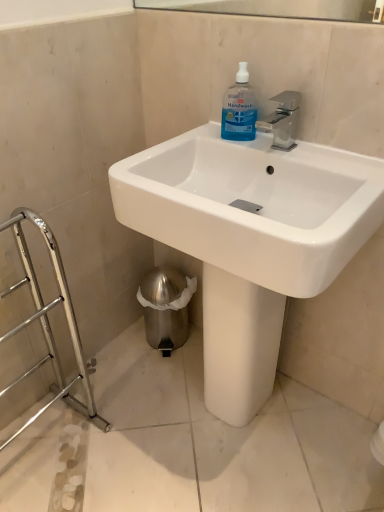
Describe the element at coordinates (239, 109) in the screenshot. I see `transparent plastic handwash at upper center` at that location.

What are the coordinates of `transparent plastic handwash at upper center` in the screenshot? It's located at (239, 109).

What is the approximate width of white glossy sink at center?

The width of white glossy sink at center is 17.06 inches.

What do you see at coordinates (250, 239) in the screenshot? This screenshot has width=384, height=512. I see `white glossy sink at center` at bounding box center [250, 239].

Image resolution: width=384 pixels, height=512 pixels. In order to click on white glossy sink at center in this screenshot , I will do (x=250, y=239).

What are the coordinates of `transparent plastic handwash at upper center` in the screenshot? It's located at [239, 109].

Visually, is white glossy sink at center positioned to the left or to the right of transparent plastic handwash at upper center?

white glossy sink at center is to the right of transparent plastic handwash at upper center.

Considering the relative positions of white glossy sink at center and transparent plastic handwash at upper center in the image provided, is white glossy sink at center behind transparent plastic handwash at upper center?

No, the depth of white glossy sink at center is less than that of transparent plastic handwash at upper center.

Which is less distant, (248, 180) or (224, 135)?

Point (248, 180) is positioned closer to the camera compared to point (224, 135).

From the image's perspective, between white glossy sink at center and transparent plastic handwash at upper center, which one is located above?

transparent plastic handwash at upper center.

From a real-world perspective, which is physically below, white glossy sink at center or transparent plastic handwash at upper center?

white glossy sink at center is physically lower.

Consider the image. Is white glossy sink at center thinner than transparent plastic handwash at upper center?

No.

Can you confirm if white glossy sink at center is shorter than transparent plastic handwash at upper center?

In fact, white glossy sink at center may be taller than transparent plastic handwash at upper center.

Does white glossy sink at center have a larger size compared to transparent plastic handwash at upper center?

Indeed, white glossy sink at center has a larger size compared to transparent plastic handwash at upper center.

Is white glossy sink at center surrounding transparent plastic handwash at upper center?

Yes, transparent plastic handwash at upper center is inside white glossy sink at center.

In the scene shown: Is white glossy sink at center far away from transparent plastic handwash at upper center?

Actually, white glossy sink at center and transparent plastic handwash at upper center are a little close together.

Is white glossy sink at center oriented away from transparent plastic handwash at upper center?

Yes, white glossy sink at center's orientation is away from transparent plastic handwash at upper center.

Measure the distance from white glossy sink at center to transparent plastic handwash at upper center.

13.64 inches.

Where is `sink located on the right of transparent plastic handwash at upper center`? This screenshot has width=384, height=512. sink located on the right of transparent plastic handwash at upper center is located at coordinates (250, 239).

In the scene shown: Between transparent plastic handwash at upper center and white glossy sink at center, which one appears on the right side from the viewer's perspective?

Positioned to the right is white glossy sink at center.

Does transparent plastic handwash at upper center come behind white glossy sink at center?

Yes, transparent plastic handwash at upper center is further from the viewer.

Is point (245, 116) closer or farther from the camera than point (332, 232)?

Point (245, 116) is farther from the camera than point (332, 232).

From the image's perspective, is transparent plastic handwash at upper center located above or below white glossy sink at center?

From the image's perspective, transparent plastic handwash at upper center appears above white glossy sink at center.

From a real-world perspective, relative to white glossy sink at center, is transparent plastic handwash at upper center vertically above or below?

From a real-world perspective, transparent plastic handwash at upper center is physically above white glossy sink at center.

Between transparent plastic handwash at upper center and white glossy sink at center, which one has larger width?

white glossy sink at center.

Does transparent plastic handwash at upper center have a lesser height compared to white glossy sink at center?

Indeed, transparent plastic handwash at upper center has a lesser height compared to white glossy sink at center.

Considering the sizes of objects transparent plastic handwash at upper center and white glossy sink at center in the image provided, who is bigger, transparent plastic handwash at upper center or white glossy sink at center?

white glossy sink at center is bigger.

Is transparent plastic handwash at upper center positioned beyond the bounds of white glossy sink at center?

No, transparent plastic handwash at upper center is inside or overlapping with white glossy sink at center.

Is transparent plastic handwash at upper center in contact with white glossy sink at center?

No.

Is white glossy sink at center at the back of transparent plastic handwash at upper center?

Yes, transparent plastic handwash at upper center's orientation is away from white glossy sink at center.

Can you tell me how much transparent plastic handwash at upper center and white glossy sink at center differ in facing direction?

1.21 degrees.

This screenshot has width=384, height=512. I want to click on sink in front of the transparent plastic handwash at upper center, so click(x=250, y=239).

Image resolution: width=384 pixels, height=512 pixels. Find the location of `sink that is on the right side of transparent plastic handwash at upper center`. sink that is on the right side of transparent plastic handwash at upper center is located at coordinates (250, 239).

At what (x,y) coordinates should I click in order to perform the action: click on cleaning product that is above the white glossy sink at center (from the image's perspective). Please return your answer as a coordinate pair (x, y). Image resolution: width=384 pixels, height=512 pixels. Looking at the image, I should click on (239, 109).